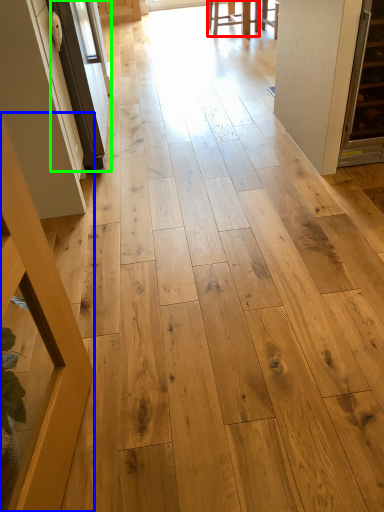
Question: Considering the real-world distances, which object is closest to furniture (highlighted by a red box)? furniture (highlighted by a blue box) or screen door (highlighted by a green box).

Choices:
 (A) furniture
 (B) screen door

Answer: (B)